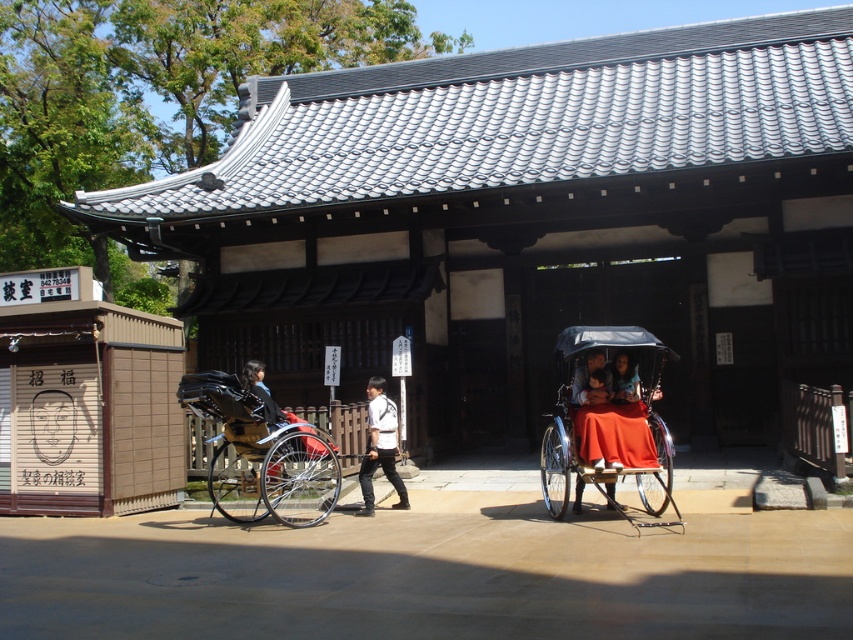
You are standing at the camera position and want to reach the point marked at coordinates (543, 490). If you walk straight ahead, how far will you have to walk to reach that point?

The point marked at coordinates (543, 490) is 10.29 meters away from the camera, so you will have to walk 10.29 meters straight ahead to reach it.

You are standing in front of a traditional wooden building with two carts in front of it. You see an orange fabric covered cart at center and a wooden cart at center. Which cart is positioned to the right of the other?

The orange fabric covered cart at center is to the right of wooden cart at center.

You are planning to park a new cart that is 1.2 meters wide in this scene. You see the orange fabric covered cart at center and the wooden cart at center. Which cart do you think your new cart can fit next to without overlapping, based on their widths?

The orange fabric covered cart at center has a lesser width compared to wooden cart at center. Since your new cart is 1.2 meters wide, it can fit next to the orange fabric covered cart at center as it is narrower, leaving enough space. However, placing it next to the wooden cart at center may be too tight due to its wider width.